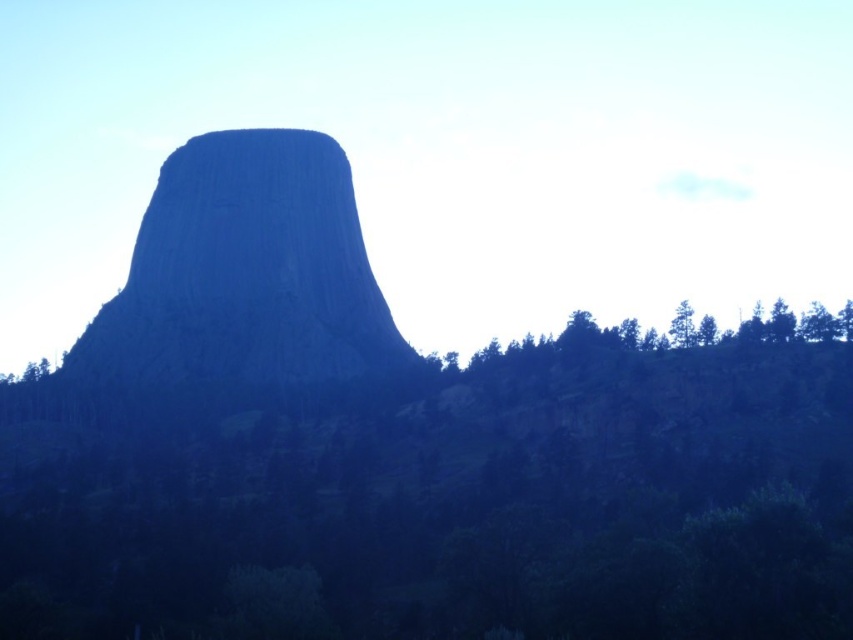
Question: Which point appears farthest from the camera in this image?

Choices:
 (A) (625, 346)
 (B) (200, 259)

Answer: (B)

Question: Which point is farther to the camera?

Choices:
 (A) rugged stone mountain at center
 (B) green leafy trees at lower right

Answer: (A)

Question: Does rugged stone mountain at center have a larger size compared to green leafy trees at lower right?

Choices:
 (A) yes
 (B) no

Answer: (A)

Question: Which point appears closest to the camera in this image?

Choices:
 (A) (271, 180)
 (B) (543, 342)
 (C) (685, 339)

Answer: (C)

Question: Is rugged stone mountain at center behind green leafy tree at upper right?

Choices:
 (A) yes
 (B) no

Answer: (A)

Question: Can you confirm if green leafy trees at lower right is smaller than green leafy tree at upper right?

Choices:
 (A) no
 (B) yes

Answer: (A)